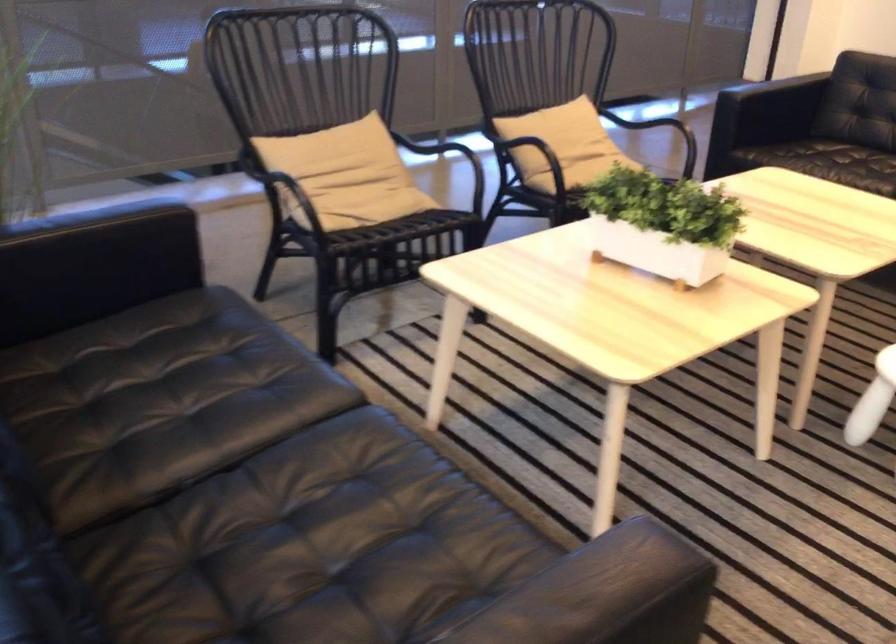
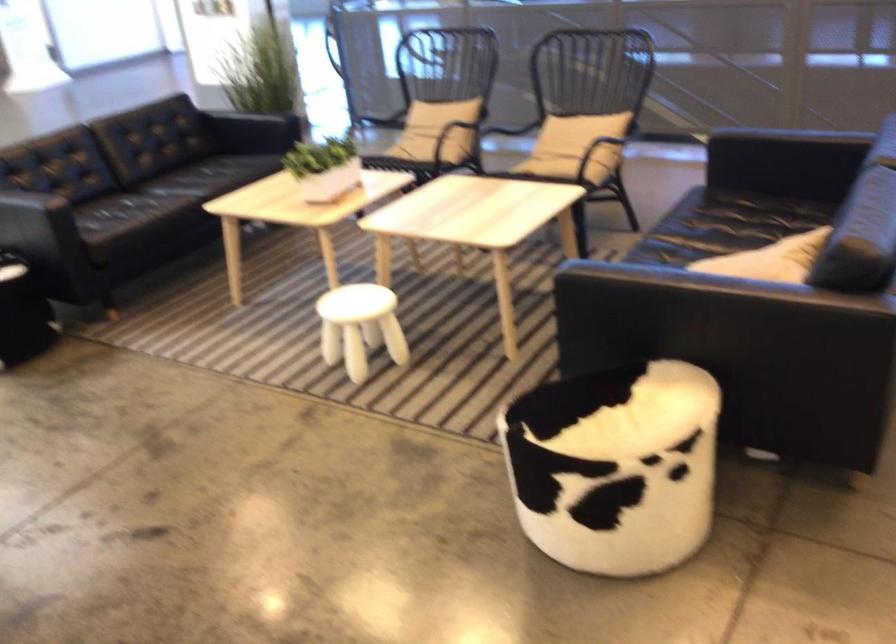
Find the pixel in the second image that matches [398,174] in the first image.

(440, 128)